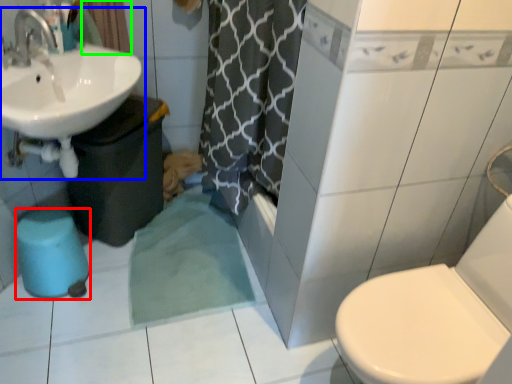
Question: Which object is positioned farthest from bidet (highlighted by a red box)? Select from sink (highlighted by a blue box) and curtain (highlighted by a green box).

Choices:
 (A) sink
 (B) curtain

Answer: (B)